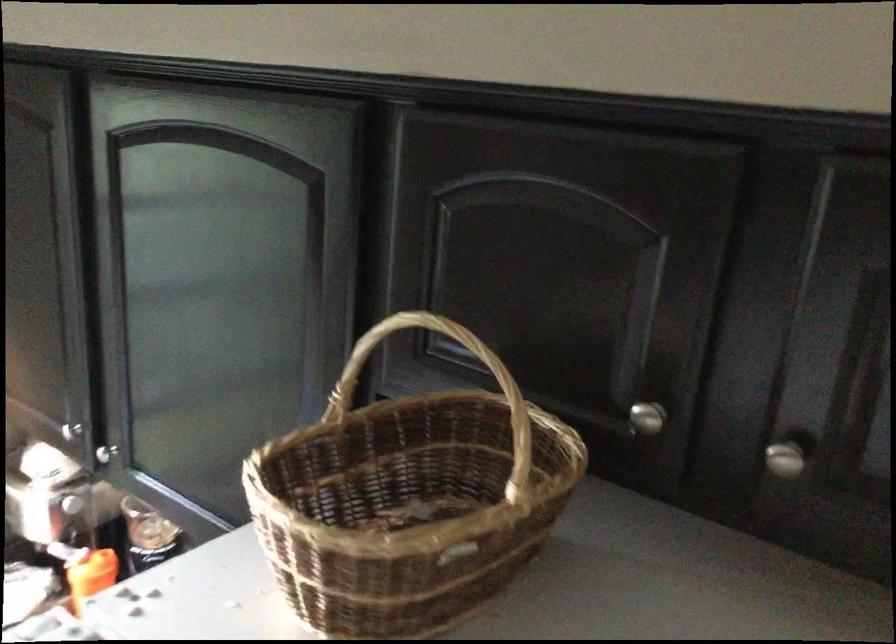
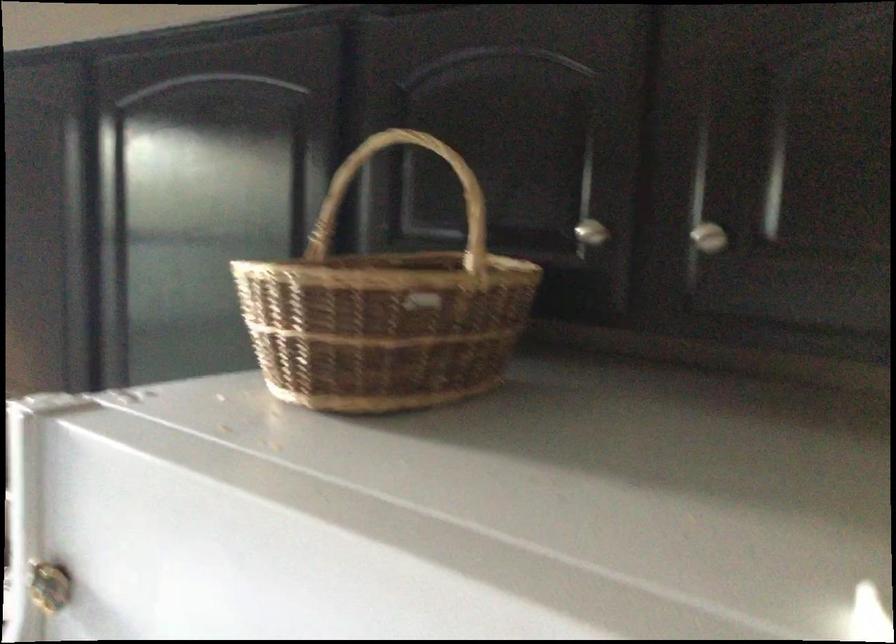
Where in the second image is the point corresponding to (x=467, y=306) from the first image?

(428, 182)